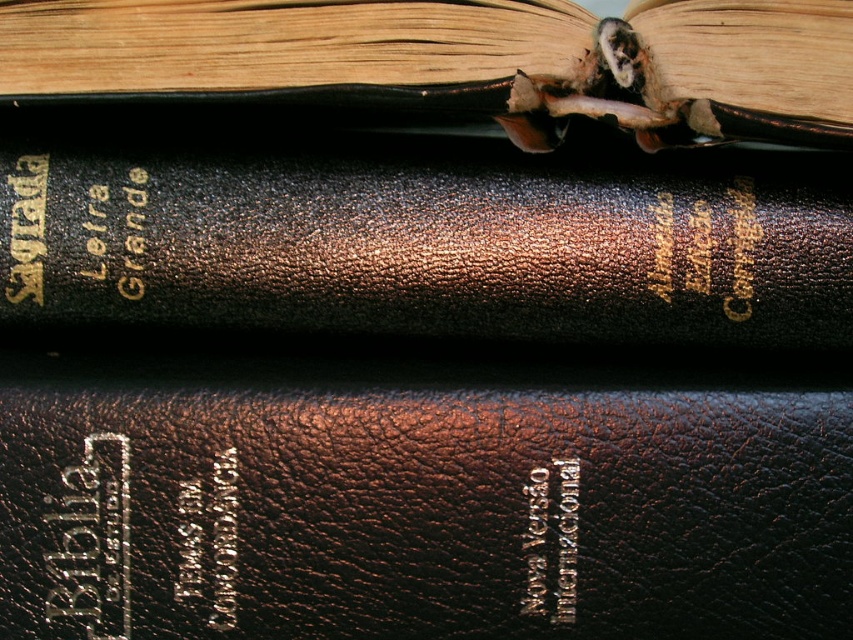
Is point (59, 403) behind point (44, 3)?

Yes, it is.

Is brown leather book at center closer to the viewer compared to leather-bound book at upper center?

No, brown leather book at center is further to the viewer.

Which is behind, point (502, 609) or point (631, 96)?

The point (502, 609) is more distant.

Locate an element on the screen. The image size is (853, 640). brown leather book at center is located at coordinates (425, 513).

Can you confirm if leather-bound book at center is positioned to the right of leather-bound book at upper center?

Yes, leather-bound book at center is to the right of leather-bound book at upper center.

Which is behind, point (427, 289) or point (733, 134)?

The point (427, 289) is behind.

Who is more distant from viewer, (67, 182) or (505, 122)?

The point (67, 182) is more distant.

Find the location of a particular element. Image resolution: width=853 pixels, height=640 pixels. leather-bound book at center is located at coordinates (427, 241).

Who is lower down, brown leather book at center or leather-bound book at center?

brown leather book at center is below.

Does brown leather book at center appear on the left side of leather-bound book at center?

No, brown leather book at center is not to the left of leather-bound book at center.

In order to click on brown leather book at center in this screenshot , I will do `click(425, 513)`.

Image resolution: width=853 pixels, height=640 pixels. In order to click on brown leather book at center in this screenshot , I will do `click(425, 513)`.